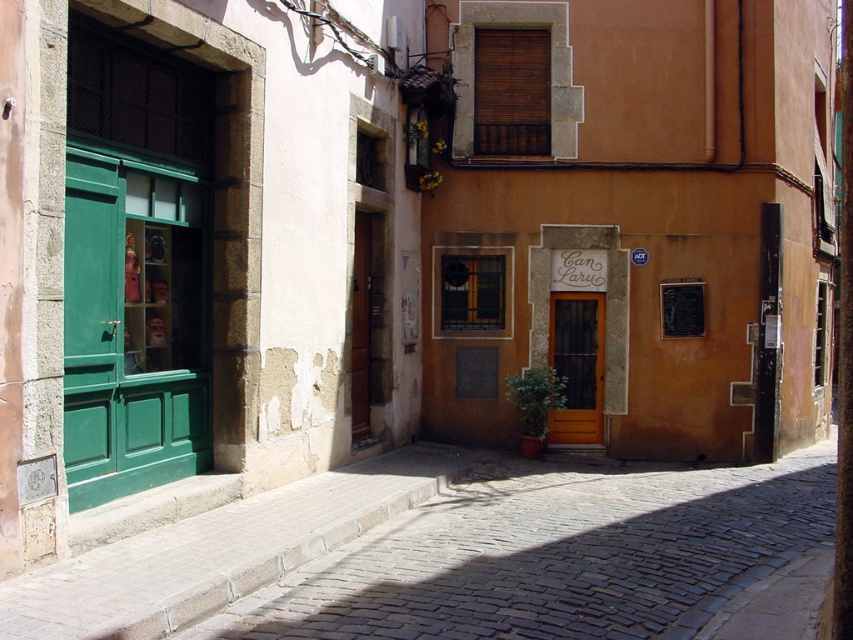
Question: Is cobblestone pavement at lower center thinner than green wood door at left?

Choices:
 (A) yes
 (B) no

Answer: (A)

Question: Which point is farther from the camera taking this photo?

Choices:
 (A) (426, 621)
 (B) (123, 253)

Answer: (B)

Question: Is cobblestone pavement at lower center positioned before brown wooden door at center?

Choices:
 (A) no
 (B) yes

Answer: (B)

Question: Considering the real-world distances, which object is closest to the green wood door at left?

Choices:
 (A) cobblestone pavement at lower center
 (B) brown wooden door at center

Answer: (A)

Question: Can you confirm if green wood door at left is positioned to the left of brown wooden door at center?

Choices:
 (A) yes
 (B) no

Answer: (A)

Question: Among these objects, which one is farthest from the camera?

Choices:
 (A) cobblestone pavement at lower center
 (B) brown wooden door at center

Answer: (B)